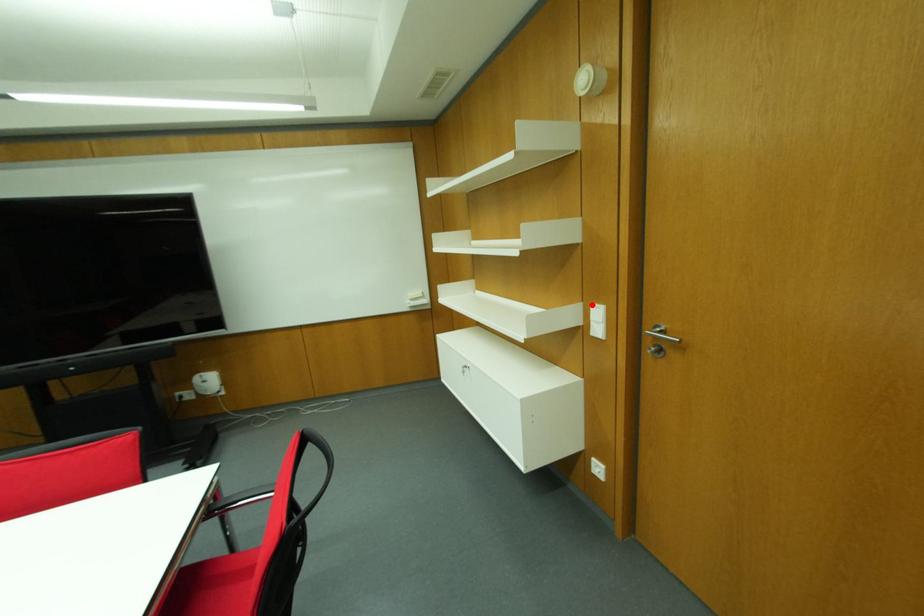
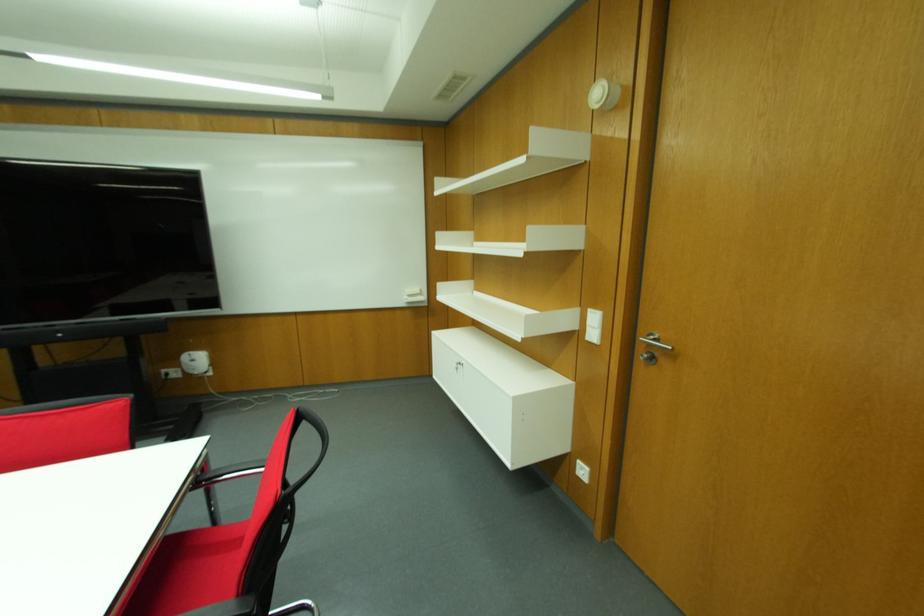
The point at the highlighted location is marked in the first image. Where is the corresponding point in the second image?

(589, 310)